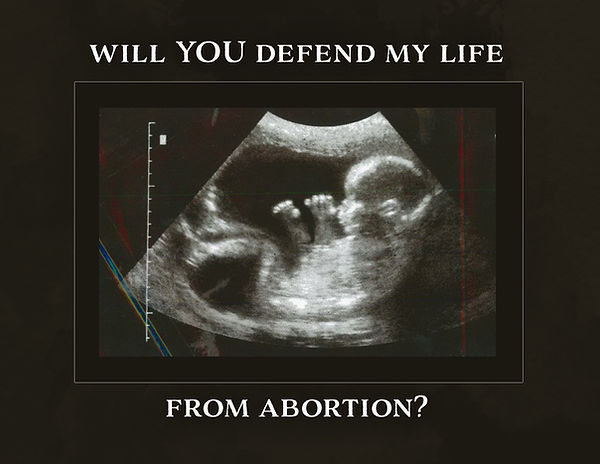
Find the location of `frame of image`. frame of image is located at coordinates (73, 81).